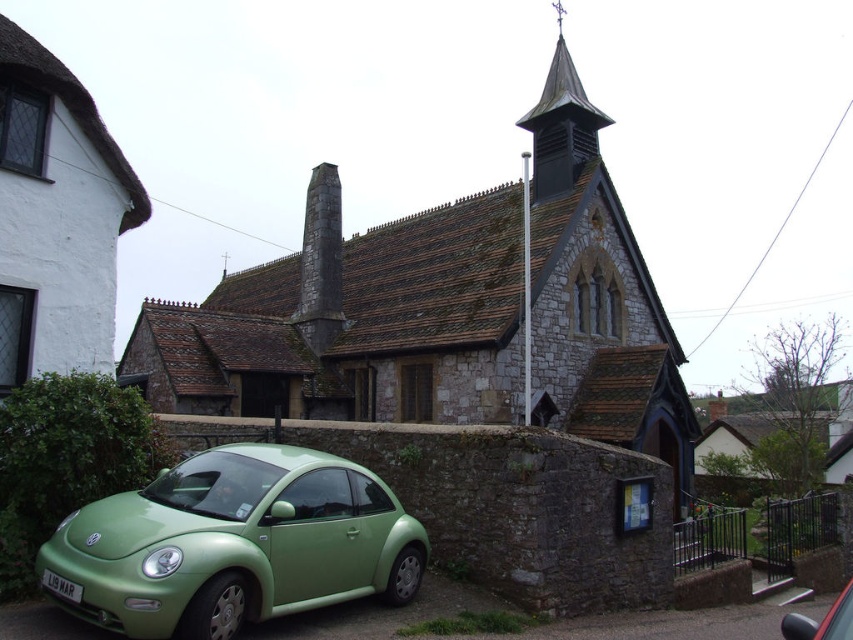
Question: Is stone church at center smaller than green matte car at lower left?

Choices:
 (A) yes
 (B) no

Answer: (B)

Question: Considering the real-world distances, which object is farthest from the matte green car at lower left?

Choices:
 (A) stone church at center
 (B) green matte car at lower left

Answer: (A)

Question: Which point is farther to the camera?

Choices:
 (A) (177, 472)
 (B) (590, 324)

Answer: (B)

Question: In this image, where is matte green car at lower left located relative to green matte car at lower left?

Choices:
 (A) right
 (B) left

Answer: (B)

Question: Among these points, which one is nearest to the camera?

Choices:
 (A) (811, 624)
 (B) (561, 243)
 (C) (39, 564)

Answer: (C)

Question: From the image, what is the correct spatial relationship of stone church at center in relation to green matte car at lower left?

Choices:
 (A) below
 (B) above

Answer: (B)